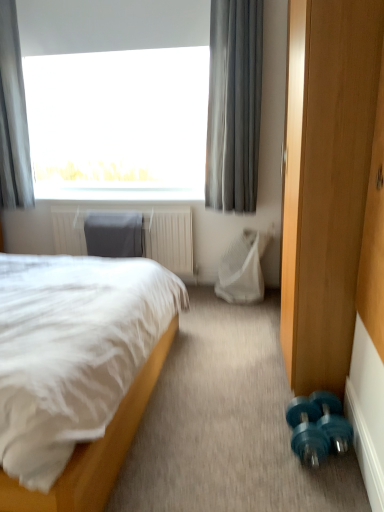
Question: Would you say white soft bed at left is inside or outside white mesh swivel chair at center, the first swivel chair when ordered from right to left?

Choices:
 (A) inside
 (B) outside

Answer: (B)

Question: In terms of height, does white soft bed at left look taller or shorter compared to white mesh swivel chair at center, which is the second swivel chair in left-to-right order?

Choices:
 (A) short
 (B) tall

Answer: (B)

Question: Considering the real-world distances, which object is closest to the gray fabric curtain at upper left, which is the 2th curtain in right-to-left order?

Choices:
 (A) teal plastic dumbbells at lower right
 (B) white mesh swivel chair at center, which is the second swivel chair in left-to-right order
 (C) gray sheer curtain at upper center, which is the 1th curtain in right-to-left order
 (D) teal rubber dumbbell at lower right
 (E) dark gray fabric swivel chair at center, the first swivel chair when ordered from left to right

Answer: (E)

Question: Which is farther from the dark gray fabric swivel chair at center, the first swivel chair when ordered from left to right?

Choices:
 (A) teal plastic dumbbells at lower right
 (B) teal rubber dumbbell at lower right
 (C) gray fabric curtain at upper left, the first curtain viewed from the left
 (D) gray sheer curtain at upper center, acting as the 2th curtain starting from the left
 (E) white soft bed at left

Answer: (B)